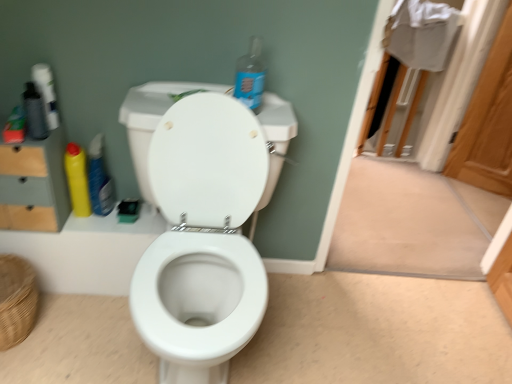
Identify the location of free space in front of wooden screen door at upper right. (479, 198).